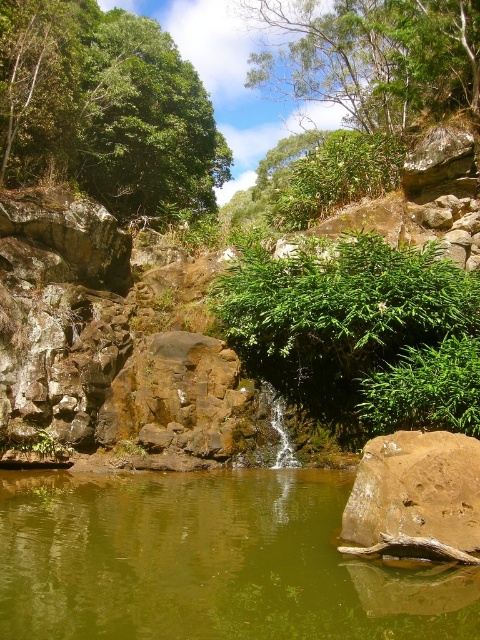
Question: Is green leafy tree at upper left to the right of brown rough rock at center from the viewer's perspective?

Choices:
 (A) no
 (B) yes

Answer: (A)

Question: Does green leafy tree at upper left have a larger size compared to brown rough rock at center?

Choices:
 (A) no
 (B) yes

Answer: (B)

Question: Which of the following is the closest to the observer?

Choices:
 (A) (252, 362)
 (B) (425, 518)
 (C) (479, 60)
 (D) (212, 173)

Answer: (B)

Question: Can you confirm if greenish-brown liquid at center is bigger than green leafy bush at center?

Choices:
 (A) no
 (B) yes

Answer: (A)

Question: Which object is farther from the camera taking this photo?

Choices:
 (A) green leafy bush at center
 (B) greenish-brown liquid at center
 (C) green leafy tree at upper center
 (D) brown rough rock at center

Answer: (C)

Question: Which object is closer to the camera taking this photo?

Choices:
 (A) green leafy tree at upper center
 (B) greenish-brown liquid at center
 (C) green leafy bush at center
 (D) brown rough rock at center

Answer: (B)